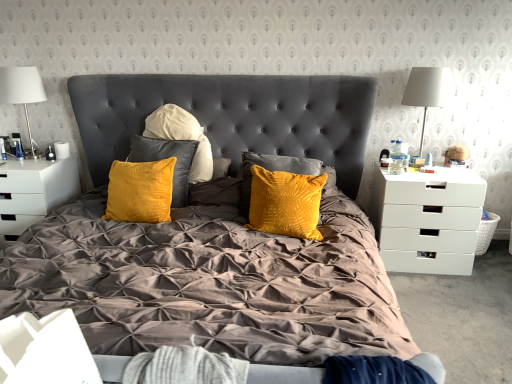
Question: Is white fabric lampshade at right, positioned as the 2th lamp in left-to-right order, far away from white matte drawer at right, acting as the 2th nightstand starting from the left?

Choices:
 (A) yes
 (B) no

Answer: (B)

Question: Is white fabric lampshade at right, the first lamp positioned from the right, positioned before white matte drawer at right, acting as the 2th nightstand starting from the left?

Choices:
 (A) yes
 (B) no

Answer: (B)

Question: Does white fabric lampshade at right, positioned as the 2th lamp in left-to-right order, turn towards white matte drawer at right, acting as the 2th nightstand starting from the left?

Choices:
 (A) no
 (B) yes

Answer: (A)

Question: Does white fabric lampshade at right, positioned as the 2th lamp in left-to-right order, have a larger size compared to white matte drawer at right, the 1th nightstand from the right?

Choices:
 (A) no
 (B) yes

Answer: (A)

Question: Would you say white matte drawer at right, acting as the 2th nightstand starting from the left, is part of white fabric lampshade at right, the first lamp positioned from the right,'s contents?

Choices:
 (A) yes
 (B) no

Answer: (B)

Question: Is white fabric at lower left inside the boundaries of white matte drawer at right, acting as the 2th nightstand starting from the left, or outside?

Choices:
 (A) outside
 (B) inside

Answer: (A)

Question: Considering their positions, is white fabric at lower left located in front of or behind white matte drawer at right, acting as the 2th nightstand starting from the left?

Choices:
 (A) front
 (B) behind

Answer: (A)

Question: From the image's perspective, is white fabric at lower left located above or below white matte drawer at right, acting as the 2th nightstand starting from the left?

Choices:
 (A) above
 (B) below

Answer: (B)

Question: Considering the positions of white fabric at lower left and white matte drawer at right, the 1th nightstand from the right, in the image, is white fabric at lower left taller or shorter than white matte drawer at right, the 1th nightstand from the right,?

Choices:
 (A) tall
 (B) short

Answer: (B)

Question: From a real-world perspective, is white fabric lampshade at right, positioned as the 2th lamp in left-to-right order, physically located above or below white wicker picnic basket at right?

Choices:
 (A) above
 (B) below

Answer: (A)

Question: Is white fabric lampshade at right, positioned as the 2th lamp in left-to-right order, to the left or to the right of white wicker picnic basket at right in the image?

Choices:
 (A) left
 (B) right

Answer: (A)

Question: In terms of width, does white fabric lampshade at right, positioned as the 2th lamp in left-to-right order, look wider or thinner when compared to white wicker picnic basket at right?

Choices:
 (A) thin
 (B) wide

Answer: (B)

Question: Is white fabric lampshade at right, positioned as the 2th lamp in left-to-right order, inside or outside of white wicker picnic basket at right?

Choices:
 (A) inside
 (B) outside

Answer: (B)

Question: Do you think velvet yellow pillow at center is within clear plastic bottle at right side, or outside of it?

Choices:
 (A) outside
 (B) inside

Answer: (A)

Question: From a real-world perspective, is velvet yellow pillow at center above or below clear plastic bottle at right side?

Choices:
 (A) below
 (B) above

Answer: (A)